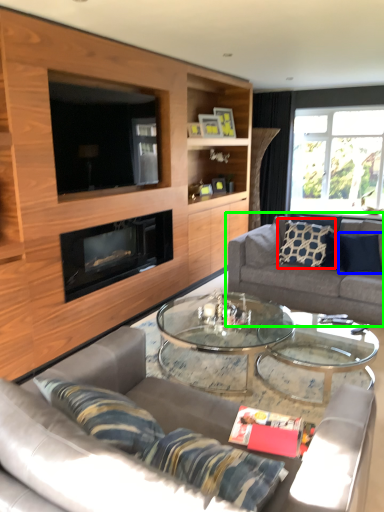
Question: Estimate the real-world distances between objects in this image. Which object is farther from pillow (highlighted by a red box), pillow (highlighted by a blue box) or studio couch (highlighted by a green box)?

Choices:
 (A) pillow
 (B) studio couch

Answer: (A)